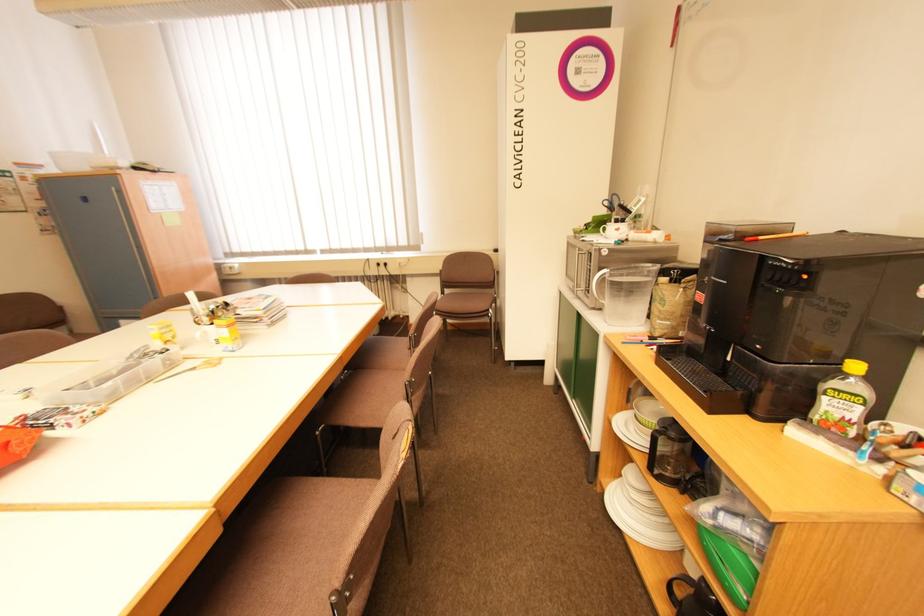
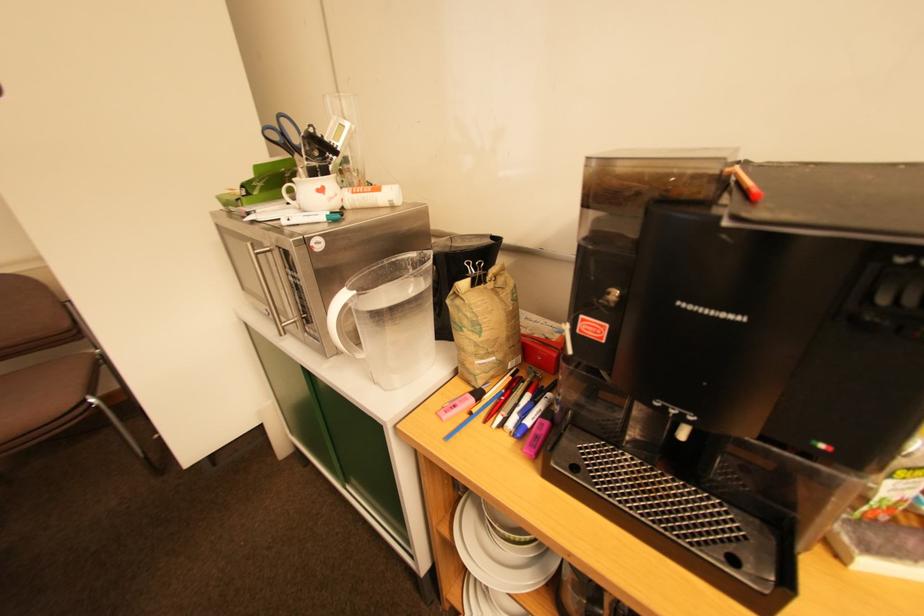
Question: How did the camera likely rotate?

Choices:
 (A) Left
 (B) Right
 (C) Up
 (D) Down

Answer: (B)